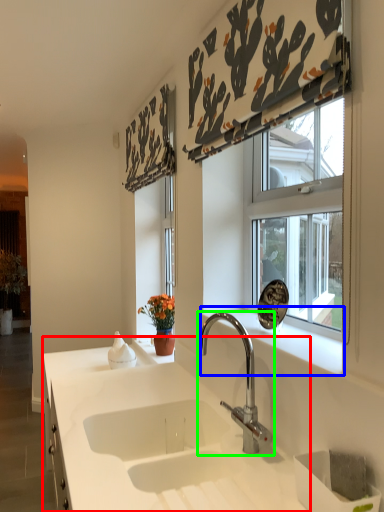
Question: Considering the real-world distances, which object is farthest from countertop (highlighted by a red box)? window sill (highlighted by a blue box) or tap (highlighted by a green box)?

Choices:
 (A) window sill
 (B) tap

Answer: (A)